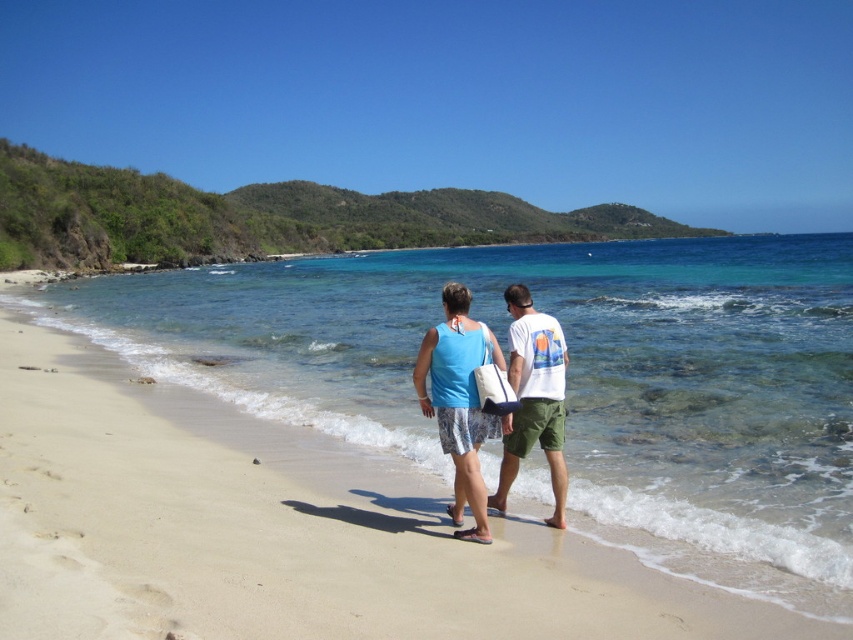
Question: Which point is closer to the camera?

Choices:
 (A) (454, 358)
 (B) (680, 572)
 (C) (509, 324)

Answer: (B)

Question: Does clear blue water at center have a smaller size compared to white cotton t-shirt at center?

Choices:
 (A) yes
 (B) no

Answer: (B)

Question: Which point appears closest to the camera in this image?

Choices:
 (A) (451, 451)
 (B) (775, 556)

Answer: (B)

Question: Is clear blue water at center bigger than white cotton t-shirt at center?

Choices:
 (A) no
 (B) yes

Answer: (B)

Question: Which is farther from the white cotton t-shirt at center?

Choices:
 (A) clear blue water at center
 (B) matte blue tank top at center

Answer: (A)

Question: Can you confirm if clear blue water at center is thinner than matte blue tank top at center?

Choices:
 (A) no
 (B) yes

Answer: (A)